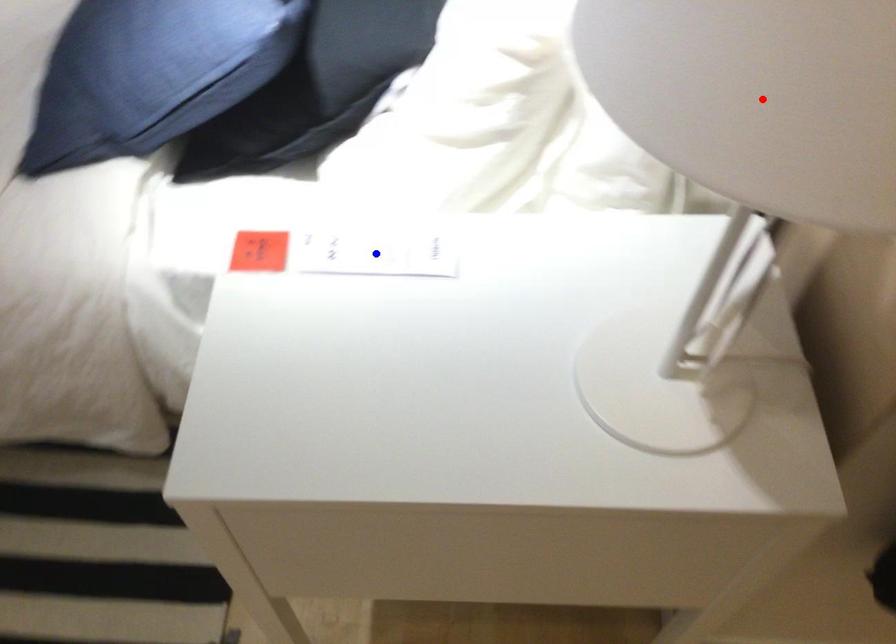
Question: Which of the two points in the image is closer to the camera?

Choices:
 (A) Blue point is closer.
 (B) Red point is closer.

Answer: (B)